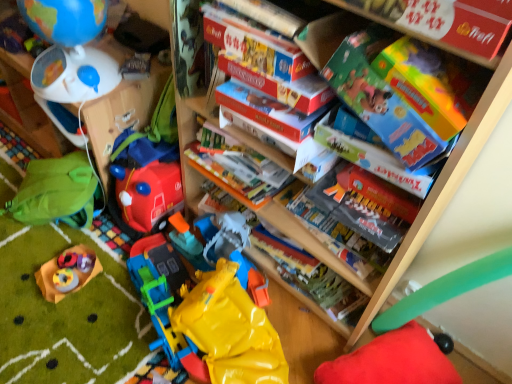
Question: From a real-world perspective, is matte blue globe at upper left, positioned as the first toy in left-to-right order, physically below red plush cushion at lower right, the 1th toy from the right?

Choices:
 (A) yes
 (B) no

Answer: (B)

Question: From a real-world perspective, does matte blue globe at upper left, marked as the 6th toy in a right-to-left arrangement, stand above red plush cushion at lower right, which ranks as the sixth toy in left-to-right order?

Choices:
 (A) no
 (B) yes

Answer: (B)

Question: Is matte blue globe at upper left, marked as the 6th toy in a right-to-left arrangement, at the right side of red plush cushion at lower right, the 1th toy from the right?

Choices:
 (A) no
 (B) yes

Answer: (A)

Question: Is matte blue globe at upper left, marked as the 6th toy in a right-to-left arrangement, next to red plush cushion at lower right, the 1th toy from the right, and touching it?

Choices:
 (A) yes
 (B) no

Answer: (B)

Question: Considering the relative sizes of matte blue globe at upper left, positioned as the first toy in left-to-right order, and red plush cushion at lower right, the 1th toy from the right, in the image provided, is matte blue globe at upper left, positioned as the first toy in left-to-right order, bigger than red plush cushion at lower right, the 1th toy from the right,?

Choices:
 (A) no
 (B) yes

Answer: (A)

Question: Looking at their shapes, would you say matte blue globe at upper left, positioned as the first toy in left-to-right order, is wider or thinner than yellow rubber toy at lower center, marked as the second toy in a right-to-left arrangement?

Choices:
 (A) wide
 (B) thin

Answer: (B)

Question: Looking at the image, does matte blue globe at upper left, marked as the 6th toy in a right-to-left arrangement, seem bigger or smaller compared to yellow rubber toy at lower center, marked as the second toy in a right-to-left arrangement?

Choices:
 (A) big
 (B) small

Answer: (B)

Question: From their relative heights in the image, would you say matte blue globe at upper left, positioned as the first toy in left-to-right order, is taller or shorter than yellow rubber toy at lower center, which ranks as the 5th toy in left-to-right order?

Choices:
 (A) tall
 (B) short

Answer: (B)

Question: From a real-world perspective, relative to yellow rubber toy at lower center, marked as the second toy in a right-to-left arrangement, is matte blue globe at upper left, marked as the 6th toy in a right-to-left arrangement, vertically above or below?

Choices:
 (A) above
 (B) below

Answer: (A)

Question: From a real-world perspective, is matte cardboard box at upper right, which is the fourth book in back-to-front order, physically located above or below yellow rubber toy at lower center, which ranks as the 5th toy in left-to-right order?

Choices:
 (A) above
 (B) below

Answer: (A)

Question: From the image's perspective, is matte cardboard box at upper right, positioned as the first book in front-to-back order, located above or below yellow rubber toy at lower center, which ranks as the 5th toy in left-to-right order?

Choices:
 (A) below
 (B) above

Answer: (B)

Question: Is point (366, 1) closer or farther from the camera than point (261, 350)?

Choices:
 (A) closer
 (B) farther

Answer: (A)

Question: Based on their sizes in the image, would you say matte cardboard box at upper right, which is the fourth book in back-to-front order, is bigger or smaller than yellow rubber toy at lower center, which ranks as the 5th toy in left-to-right order?

Choices:
 (A) small
 (B) big

Answer: (A)

Question: From a real-world perspective, is matte cardboard box at upper center, which is the 2th book from front to back, positioned above or below red plush cushion at lower right, the 1th toy from the right?

Choices:
 (A) below
 (B) above

Answer: (B)

Question: Considering the positions of point (305, 76) and point (394, 339), is point (305, 76) closer or farther from the camera than point (394, 339)?

Choices:
 (A) closer
 (B) farther

Answer: (A)